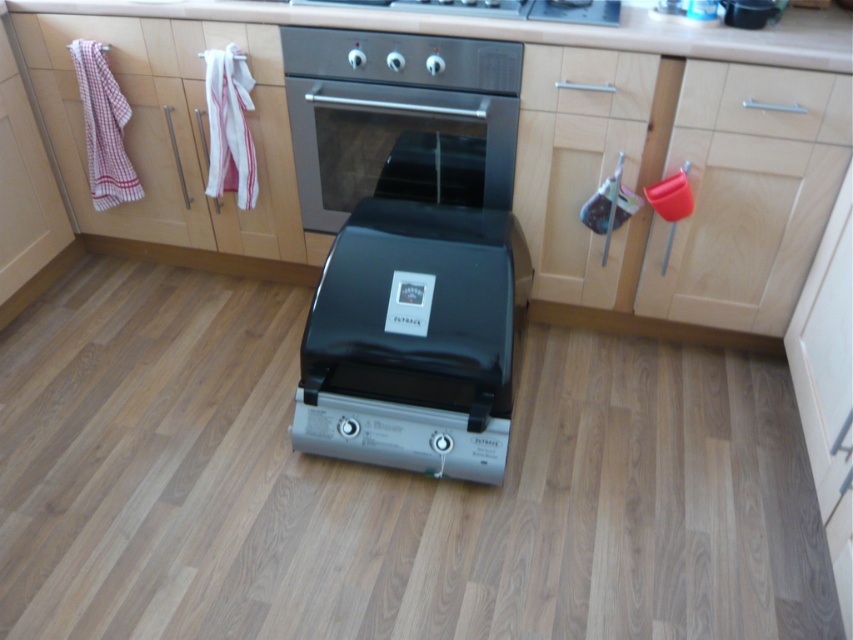
Is glossy ceramic countertop at upper center below wooden drawer at center?

Actually, glossy ceramic countertop at upper center is above wooden drawer at center.

Does glossy ceramic countertop at upper center appear on the right side of wooden drawer at center?

No, glossy ceramic countertop at upper center is not to the right of wooden drawer at center.

Where is `glossy ceramic countertop at upper center`? The height and width of the screenshot is (640, 853). glossy ceramic countertop at upper center is located at coordinates (523, 28).

Can you confirm if stainless steel oven at center is positioned below satin silver oven at upper center?

Correct, stainless steel oven at center is located below satin silver oven at upper center.

Does point (407, 51) come in front of point (352, 1)?

Yes, it is in front of point (352, 1).

Locate an element on the screen. The height and width of the screenshot is (640, 853). stainless steel oven at center is located at coordinates (393, 112).

Locate an element on the screen. This screenshot has width=853, height=640. stainless steel oven at center is located at coordinates (393, 112).

Measure the distance between wooden drawer at center and camera.

A distance of 1.70 meters exists between wooden drawer at center and camera.

Does wooden drawer at center come behind satin silver oven at upper center?

No, it is in front of satin silver oven at upper center.

Who is more distant from viewer, (648, 81) or (608, 10)?

The point (608, 10) is more distant.

Locate an element on the screen. wooden drawer at center is located at coordinates (606, 83).